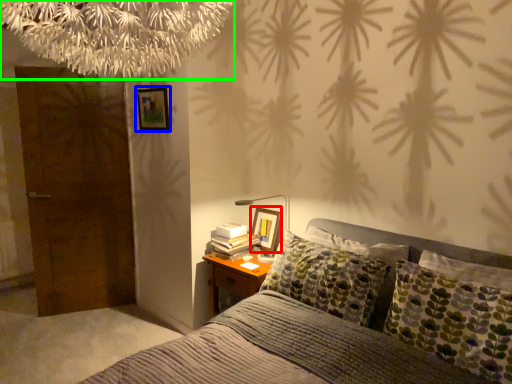
Question: Which object is the closest to the picture frame (highlighted by a red box)? Choose among these: picture frame (highlighted by a blue box) or tree (highlighted by a green box).

Choices:
 (A) picture frame
 (B) tree

Answer: (A)